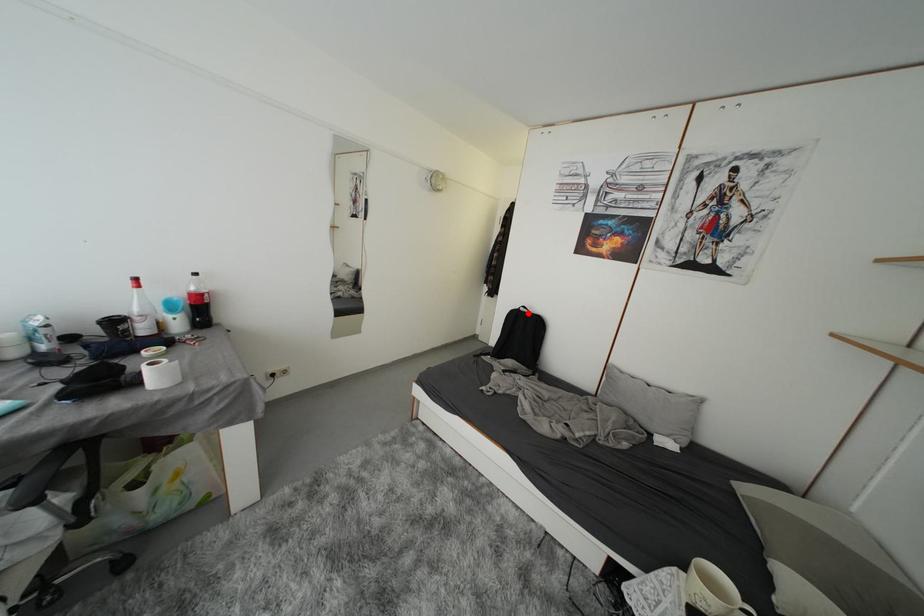
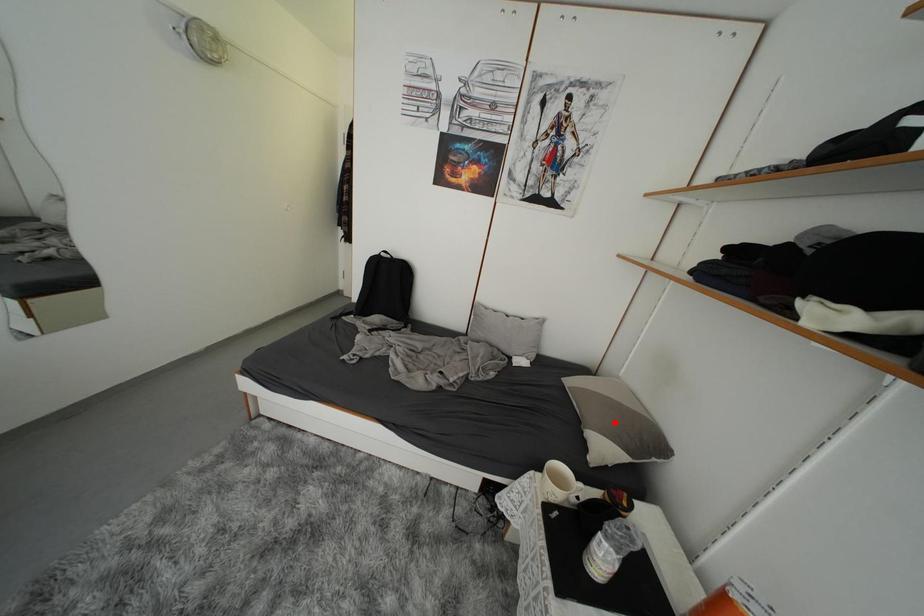
I am providing you with two images of the same scene from different viewpoints. A red point is marked on the first image and another point is marked on the second image. Are the points marked in image1 and image2 representing the same 3D position?

No